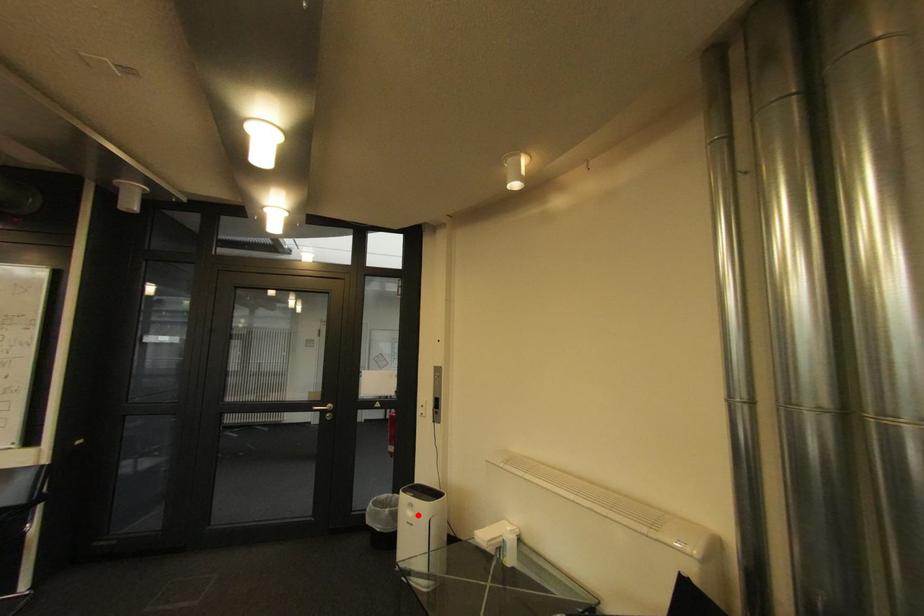
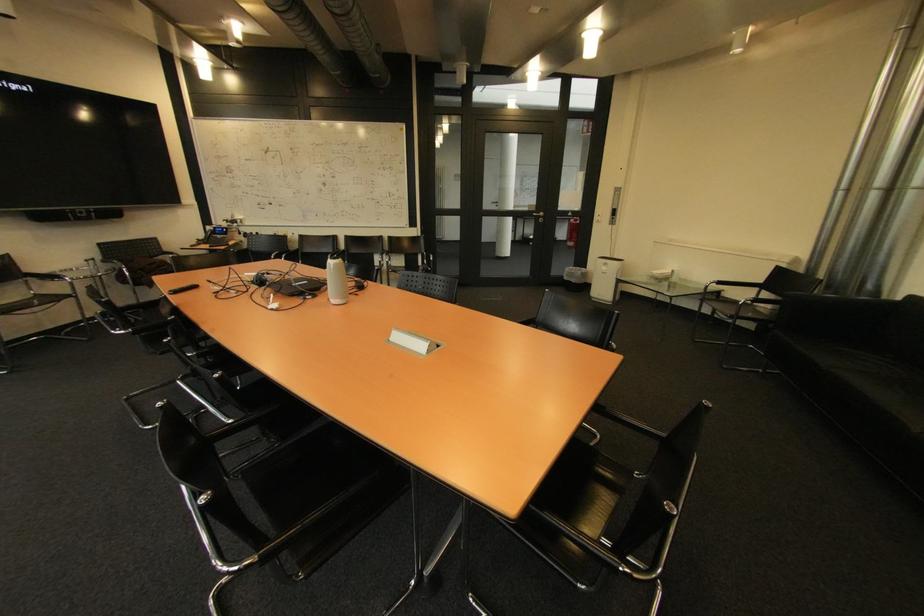
In the second image, find the point that corresponds to the highlighted location in the first image.

(613, 270)